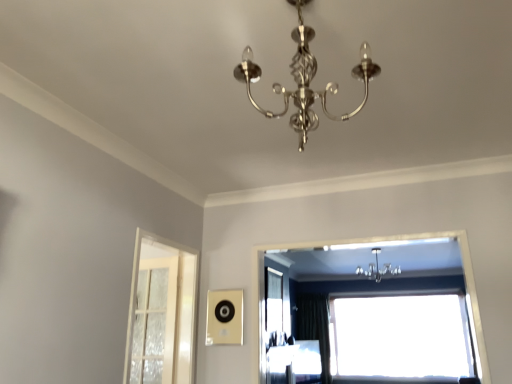
Question: Is shiny silver chandelier at center taller than transparent glass window at upper center, which is counted as the second window, starting from the front?

Choices:
 (A) no
 (B) yes

Answer: (A)

Question: Can you confirm if shiny silver chandelier at center is bigger than transparent glass window at upper center, arranged as the second window when viewed from the left?

Choices:
 (A) yes
 (B) no

Answer: (B)

Question: Is shiny silver chandelier at center closer to the viewer compared to transparent glass window at upper center, the 2th window when ordered from top to bottom?

Choices:
 (A) yes
 (B) no

Answer: (A)

Question: Does shiny silver chandelier at center have a greater width compared to transparent glass window at upper center, the 2th window when ordered from top to bottom?

Choices:
 (A) no
 (B) yes

Answer: (B)

Question: Is shiny silver chandelier at center not close to transparent glass window at upper center, placed as the 1th window when sorted from bottom to top?

Choices:
 (A) no
 (B) yes

Answer: (B)

Question: Looking at their shapes, would you say transparent glass window at center, which appears as the 1th window when viewed from the left, is wider or thinner than metallic chandelier at upper center?

Choices:
 (A) thin
 (B) wide

Answer: (B)

Question: Do you think transparent glass window at center, placed as the 2th window when sorted from bottom to top, is within metallic chandelier at upper center, or outside of it?

Choices:
 (A) outside
 (B) inside

Answer: (A)

Question: Is transparent glass window at center, the 1th window from the front, taller or shorter than metallic chandelier at upper center?

Choices:
 (A) short
 (B) tall

Answer: (B)

Question: From the image's perspective, is transparent glass window at center, placed as the 2th window when sorted from bottom to top, positioned above or below metallic chandelier at upper center?

Choices:
 (A) above
 (B) below

Answer: (A)

Question: Considering the positions of metallic chandelier at upper center and white frosted glass screen door at left in the image, is metallic chandelier at upper center wider or thinner than white frosted glass screen door at left?

Choices:
 (A) wide
 (B) thin

Answer: (A)

Question: Is metallic chandelier at upper center inside the boundaries of white frosted glass screen door at left, or outside?

Choices:
 (A) inside
 (B) outside

Answer: (B)

Question: Is metallic chandelier at upper center taller or shorter than white frosted glass screen door at left?

Choices:
 (A) tall
 (B) short

Answer: (B)

Question: From the image's perspective, is metallic chandelier at upper center positioned above or below white frosted glass screen door at left?

Choices:
 (A) below
 (B) above

Answer: (A)

Question: Considering the positions of transparent glass window at upper center, arranged as the second window when viewed from the left, and white frosted glass screen door at left in the image, is transparent glass window at upper center, arranged as the second window when viewed from the left, taller or shorter than white frosted glass screen door at left?

Choices:
 (A) short
 (B) tall

Answer: (B)

Question: Relative to white frosted glass screen door at left, is transparent glass window at upper center, placed as the 1th window when sorted from bottom to top, in front or behind?

Choices:
 (A) front
 (B) behind

Answer: (B)